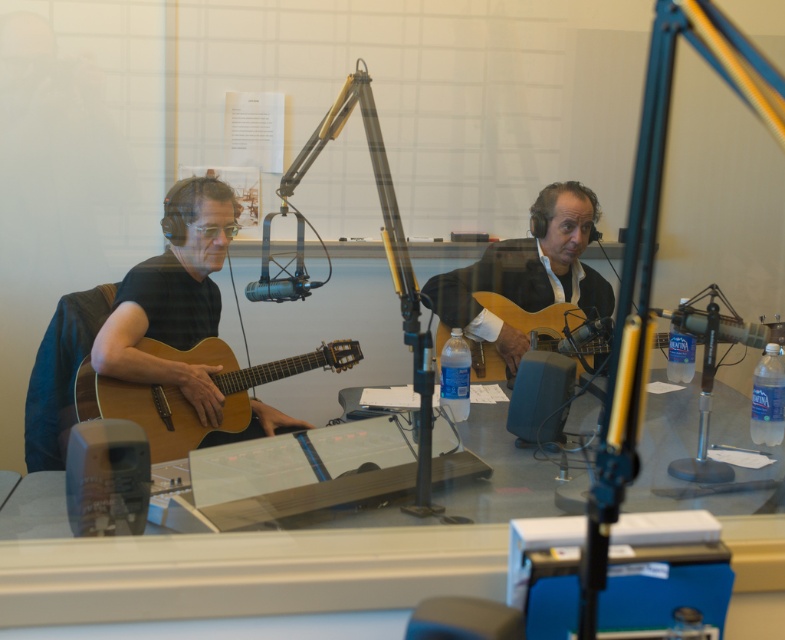
You are a technician in a radio studio. You need to place a new microphone stand exactly where the light wood acoustic guitar at center is currently located. The guitar is at point [535,317]. Can you confirm the coordinates of the light wood acoustic guitar at center?

The light wood acoustic guitar at center is represented by point [535,317].